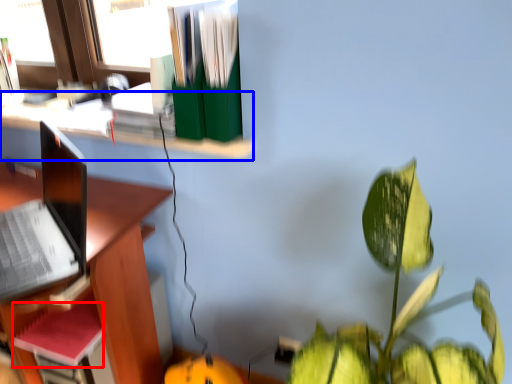
Question: Which of the following is the closest to the observer, paperback book (highlighted by a red box) or shelf (highlighted by a blue box)?

Choices:
 (A) paperback book
 (B) shelf

Answer: (B)